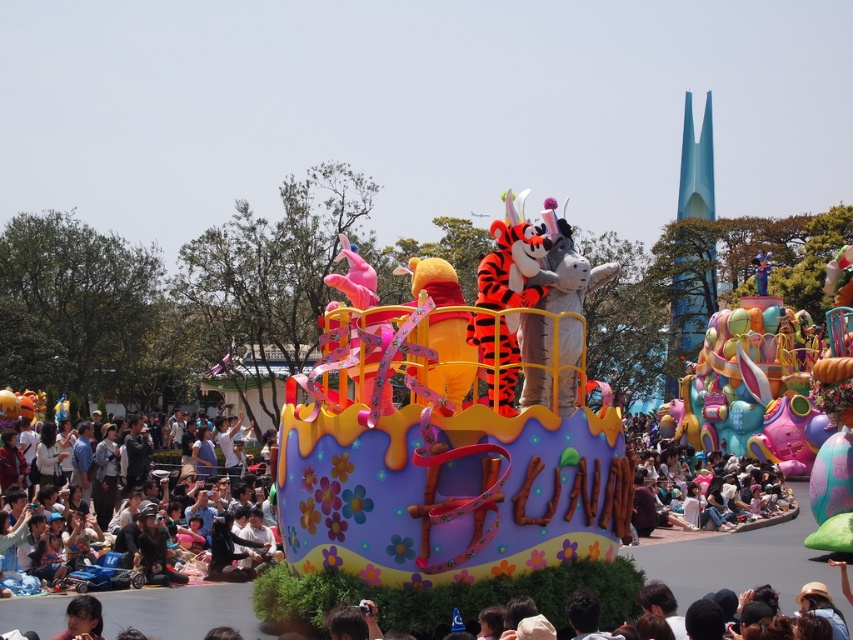
Between matte plastic cake at center and matte black jacket at lower left, which one has more height?

matte plastic cake at center is taller.

Does matte plastic cake at center appear over matte black jacket at lower left?

Indeed, matte plastic cake at center is positioned over matte black jacket at lower left.

Describe the element at coordinates (453, 429) in the screenshot. I see `matte plastic cake at center` at that location.

The width and height of the screenshot is (853, 640). I want to click on matte plastic cake at center, so click(x=453, y=429).